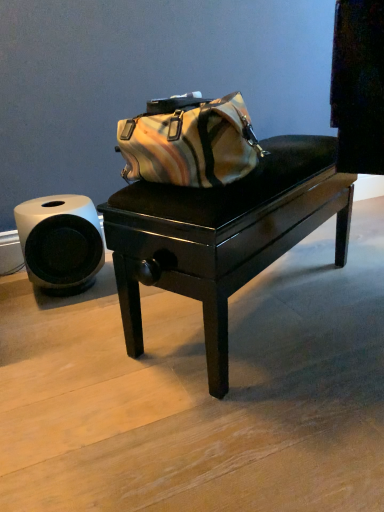
You are a GUI agent. You are given a task and a screenshot of the screen. Output one action in this format:
    pyautogui.click(x=<x>, y=<y>)
    Task: Click on the free point in front of glossy black table at center
    The image size is (384, 512).
    Given the screenshot: What is the action you would take?
    pyautogui.click(x=253, y=406)